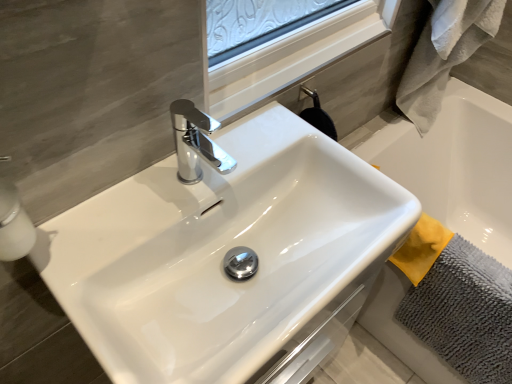
Identify the location of white glossy soap dispenser at left. (14, 225).

In order to click on gray fluffy bath towel at right, acting as the first bath towel starting from the top in this screenshot , I will do `click(444, 54)`.

What do you see at coordinates (444, 54) in the screenshot? I see `gray fluffy bath towel at right, acting as the first bath towel starting from the top` at bounding box center [444, 54].

The width and height of the screenshot is (512, 384). In order to click on white glossy sink at center in this screenshot , I will do `click(222, 253)`.

Considering the relative sizes of gray microfiber bath towel at lower right, the 1th bath towel when ordered from bottom to top, and white glossy sink at center in the image provided, is gray microfiber bath towel at lower right, the 1th bath towel when ordered from bottom to top, smaller than white glossy sink at center?

Yes, gray microfiber bath towel at lower right, the 1th bath towel when ordered from bottom to top, is smaller than white glossy sink at center.

From a real-world perspective, which object stands above the other?

white glossy sink at center is physically above.

Does gray microfiber bath towel at lower right, the 1th bath towel when ordered from bottom to top, appear on the left side of white glossy sink at center?

No, gray microfiber bath towel at lower right, the 1th bath towel when ordered from bottom to top, is not to the left of white glossy sink at center.

Is gray microfiber bath towel at lower right, the 1th bath towel when ordered from bottom to top, not close to white glossy sink at center?

No, gray microfiber bath towel at lower right, the 1th bath towel when ordered from bottom to top, is not far away from white glossy sink at center.

Is white glossy soap dispenser at left facing towards gray microfiber bath towel at lower right, the second bath towel in the top-to-bottom sequence?

No, white glossy soap dispenser at left does not turn towards gray microfiber bath towel at lower right, the second bath towel in the top-to-bottom sequence.

From the image's perspective, between white glossy soap dispenser at left and gray microfiber bath towel at lower right, the second bath towel in the top-to-bottom sequence, which one is located above?

white glossy soap dispenser at left is shown above in the image.

Does white glossy soap dispenser at left touch gray microfiber bath towel at lower right, the second bath towel in the top-to-bottom sequence?

They are not placed beside each other.

Can we say gray fluffy bath towel at right, which is the 2th bath towel from bottom to top, lies outside gray microfiber bath towel at lower right, the 1th bath towel when ordered from bottom to top?

Indeed, gray fluffy bath towel at right, which is the 2th bath towel from bottom to top, is completely outside gray microfiber bath towel at lower right, the 1th bath towel when ordered from bottom to top.

From the image's perspective, does gray fluffy bath towel at right, which is the 2th bath towel from bottom to top, appear lower than gray microfiber bath towel at lower right, the second bath towel in the top-to-bottom sequence?

No.

Could you tell me if gray fluffy bath towel at right, acting as the first bath towel starting from the top, is facing gray microfiber bath towel at lower right, the second bath towel in the top-to-bottom sequence?

No, gray fluffy bath towel at right, acting as the first bath towel starting from the top, is not oriented towards gray microfiber bath towel at lower right, the second bath towel in the top-to-bottom sequence.

Who is bigger, gray fluffy bath towel at right, which is the 2th bath towel from bottom to top, or white glossy sink at center?

Bigger between the two is white glossy sink at center.

Considering the sizes of objects gray fluffy bath towel at right, acting as the first bath towel starting from the top, and white glossy sink at center in the image provided, who is thinner, gray fluffy bath towel at right, acting as the first bath towel starting from the top, or white glossy sink at center?

gray fluffy bath towel at right, acting as the first bath towel starting from the top, is thinner.

Could you tell me if gray fluffy bath towel at right, which is the 2th bath towel from bottom to top, is turned towards white glossy sink at center?

No, gray fluffy bath towel at right, which is the 2th bath towel from bottom to top, is not aimed at white glossy sink at center.

How many degrees apart are the facing directions of gray fluffy bath towel at right, acting as the first bath towel starting from the top, and white glossy sink at center?

The facing directions of gray fluffy bath towel at right, acting as the first bath towel starting from the top, and white glossy sink at center are 0.868 degrees apart.

Between gray microfiber bath towel at lower right, the 1th bath towel when ordered from bottom to top, and white glossy soap dispenser at left, which one has more height?

With more height is gray microfiber bath towel at lower right, the 1th bath towel when ordered from bottom to top.

From a real-world perspective, is gray microfiber bath towel at lower right, the second bath towel in the top-to-bottom sequence, physically located above or below white glossy soap dispenser at left?

In terms of real-world spatial position, gray microfiber bath towel at lower right, the second bath towel in the top-to-bottom sequence, is below white glossy soap dispenser at left.

Based on the photo, what's the angular difference between gray microfiber bath towel at lower right, the 1th bath towel when ordered from bottom to top, and white glossy soap dispenser at left's facing directions?

They differ by 89.7 degrees in their facing directions.

Considering the sizes of gray microfiber bath towel at lower right, the 1th bath towel when ordered from bottom to top, and white glossy soap dispenser at left in the image, is gray microfiber bath towel at lower right, the 1th bath towel when ordered from bottom to top, bigger or smaller than white glossy soap dispenser at left?

gray microfiber bath towel at lower right, the 1th bath towel when ordered from bottom to top, is bigger than white glossy soap dispenser at left.

In the scene shown: Is white glossy sink at center further to camera compared to white glossy soap dispenser at left?

Yes.

Looking at the image, does white glossy sink at center seem bigger or smaller compared to white glossy soap dispenser at left?

Clearly, white glossy sink at center is larger in size than white glossy soap dispenser at left.

Looking at this image, can you confirm if white glossy sink at center is wider than white glossy soap dispenser at left?

Indeed, white glossy sink at center has a greater width compared to white glossy soap dispenser at left.

Consider the image. How many degrees apart are the facing directions of white glossy sink at center and white glossy soap dispenser at left?

The angular difference between white glossy sink at center and white glossy soap dispenser at left is 0.0119 degrees.

Is gray fluffy bath towel at right, acting as the first bath towel starting from the top, a part of white glossy soap dispenser at left?

No.

Looking at this image, from a real-world perspective, which is physically above, white glossy soap dispenser at left or gray fluffy bath towel at right, acting as the first bath towel starting from the top?

From a 3D spatial view, white glossy soap dispenser at left is above.

Based on the photo, between white glossy soap dispenser at left and gray fluffy bath towel at right, which is the 2th bath towel from bottom to top, which one has more height?

gray fluffy bath towel at right, which is the 2th bath towel from bottom to top, is taller.

Between white glossy soap dispenser at left and gray fluffy bath towel at right, acting as the first bath towel starting from the top, which one has smaller width?

white glossy soap dispenser at left.

Identify the location of bath towel below the white glossy sink at center (from a real-world perspective). (464, 312).

You are a GUI agent. You are given a task and a screenshot of the screen. Output one action in this format:
    pyautogui.click(x=<x>, y=<y>)
    Task: Click on the soap dispenser on the left of gray microfiber bath towel at lower right, the 1th bath towel when ordered from bottom to top
    
    Given the screenshot: What is the action you would take?
    pyautogui.click(x=14, y=225)

Considering their positions, is gray fluffy bath towel at right, which is the 2th bath towel from bottom to top, positioned closer to white glossy soap dispenser at left than white glossy sink at center?

Among the two, white glossy sink at center is located nearer to white glossy soap dispenser at left.

Looking at the image, which one is located further to gray microfiber bath towel at lower right, the 1th bath towel when ordered from bottom to top, gray fluffy bath towel at right, acting as the first bath towel starting from the top, or white glossy soap dispenser at left?

white glossy soap dispenser at left is positioned further to the anchor gray microfiber bath towel at lower right, the 1th bath towel when ordered from bottom to top.

From the picture: Looking at the image, which one is located closer to gray fluffy bath towel at right, which is the 2th bath towel from bottom to top, white glossy sink at center or gray microfiber bath towel at lower right, the second bath towel in the top-to-bottom sequence?

gray microfiber bath towel at lower right, the second bath towel in the top-to-bottom sequence.

Looking at the image, which one is located further to gray microfiber bath towel at lower right, the second bath towel in the top-to-bottom sequence, gray fluffy bath towel at right, which is the 2th bath towel from bottom to top, or white glossy sink at center?

gray fluffy bath towel at right, which is the 2th bath towel from bottom to top, is further to gray microfiber bath towel at lower right, the second bath towel in the top-to-bottom sequence.

Estimate the real-world distances between objects in this image. Which object is closer to gray microfiber bath towel at lower right, the second bath towel in the top-to-bottom sequence, white glossy sink at center or white glossy soap dispenser at left?

white glossy sink at center is closer to gray microfiber bath towel at lower right, the second bath towel in the top-to-bottom sequence.

Looking at the image, which one is located further to gray fluffy bath towel at right, which is the 2th bath towel from bottom to top, gray microfiber bath towel at lower right, the 1th bath towel when ordered from bottom to top, or white glossy soap dispenser at left?

white glossy soap dispenser at left is positioned further to the anchor gray fluffy bath towel at right, which is the 2th bath towel from bottom to top.

Considering their positions, is white glossy sink at center positioned further to gray microfiber bath towel at lower right, the 1th bath towel when ordered from bottom to top, than gray fluffy bath towel at right, which is the 2th bath towel from bottom to top?

gray fluffy bath towel at right, which is the 2th bath towel from bottom to top, is positioned further to the anchor gray microfiber bath towel at lower right, the 1th bath towel when ordered from bottom to top.

From the image, which object appears to be farther from white glossy soap dispenser at left, gray fluffy bath towel at right, acting as the first bath towel starting from the top, or gray microfiber bath towel at lower right, the 1th bath towel when ordered from bottom to top?

Among the two, gray fluffy bath towel at right, acting as the first bath towel starting from the top, is located further to white glossy soap dispenser at left.

Locate an element on the screen. sink located between white glossy soap dispenser at left and gray microfiber bath towel at lower right, the 1th bath towel when ordered from bottom to top, in the left-right direction is located at coordinates (222, 253).

Where is `sink between gray fluffy bath towel at right, acting as the first bath towel starting from the top, and gray microfiber bath towel at lower right, the second bath towel in the top-to-bottom sequence, in the vertical direction`? sink between gray fluffy bath towel at right, acting as the first bath towel starting from the top, and gray microfiber bath towel at lower right, the second bath towel in the top-to-bottom sequence, in the vertical direction is located at coordinates (222, 253).

You are a GUI agent. You are given a task and a screenshot of the screen. Output one action in this format:
    pyautogui.click(x=<x>, y=<y>)
    Task: Click on the bath towel located between white glossy soap dispenser at left and gray microfiber bath towel at lower right, the 1th bath towel when ordered from bottom to top, in the left-right direction
    Image resolution: width=512 pixels, height=384 pixels.
    Given the screenshot: What is the action you would take?
    pyautogui.click(x=444, y=54)

I want to click on sink between white glossy soap dispenser at left and gray fluffy bath towel at right, which is the 2th bath towel from bottom to top, so [222, 253].